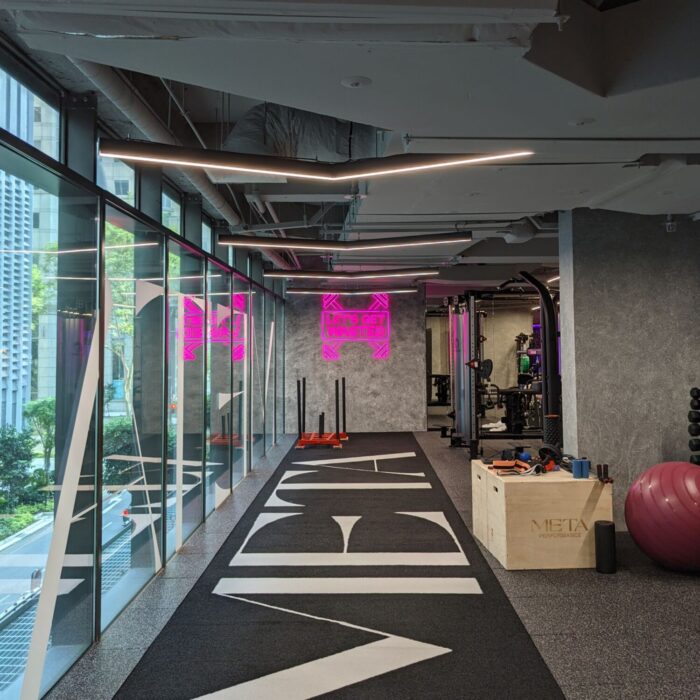
Where is `textured gray flooring`? Image resolution: width=700 pixels, height=700 pixels. textured gray flooring is located at coordinates (603, 620), (172, 581).